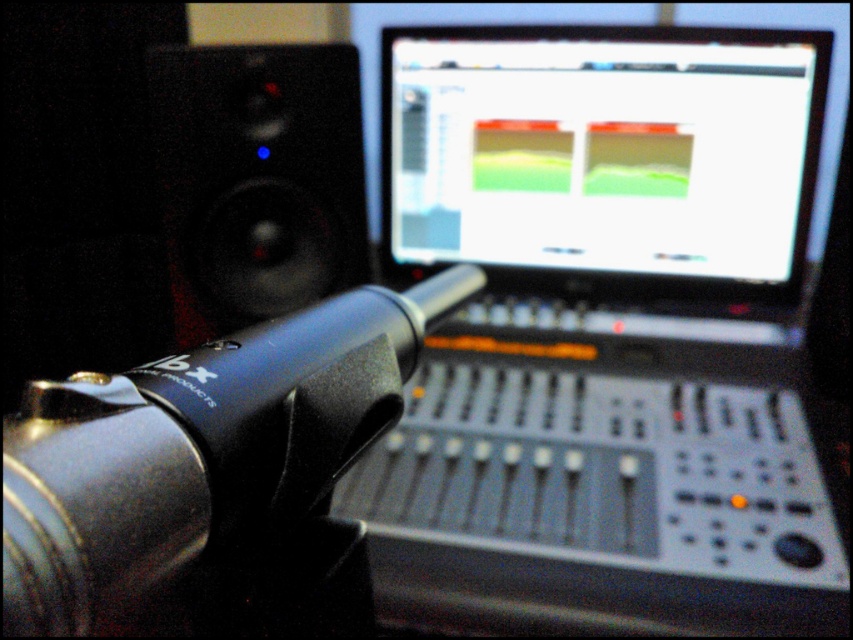
Question: Can you confirm if black matte microphone at center-left is smaller than black matte speaker at left?

Choices:
 (A) no
 (B) yes

Answer: (A)

Question: Is matte plastic screen at upper center to the right of black matte speaker at left from the viewer's perspective?

Choices:
 (A) yes
 (B) no

Answer: (A)

Question: Which of the following is the closest to the observer?

Choices:
 (A) black matte microphone at center-left
 (B) black matte speaker at left
 (C) matte plastic screen at upper center

Answer: (A)

Question: Which point is closer to the camera taking this photo?

Choices:
 (A) (395, 387)
 (B) (579, 188)
 (C) (355, 140)

Answer: (A)

Question: Which point appears farthest from the camera in this image?

Choices:
 (A) (283, 209)
 (B) (194, 460)
 (C) (459, 204)

Answer: (C)

Question: Can you confirm if matte plastic screen at upper center is wider than black matte speaker at left?

Choices:
 (A) yes
 (B) no

Answer: (A)